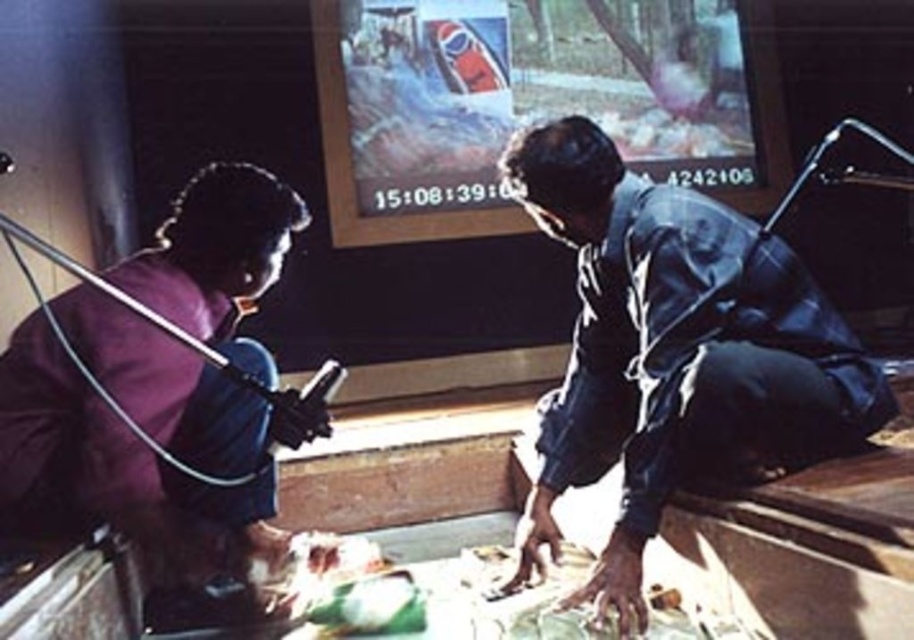
Question: Is the position of dark blue fabric at right more distant than that of purple fabric at lower left?

Choices:
 (A) yes
 (B) no

Answer: (A)

Question: Can you confirm if dark blue fabric at right is smaller than purple fabric at lower left?

Choices:
 (A) yes
 (B) no

Answer: (B)

Question: Does dark blue fabric at right lie behind purple fabric at lower left?

Choices:
 (A) yes
 (B) no

Answer: (A)

Question: Which point is closer to the camera?

Choices:
 (A) dark blue fabric at right
 (B) purple fabric at lower left

Answer: (B)

Question: Which object is farther from the camera taking this photo?

Choices:
 (A) purple fabric at lower left
 (B) dark blue fabric at right

Answer: (B)